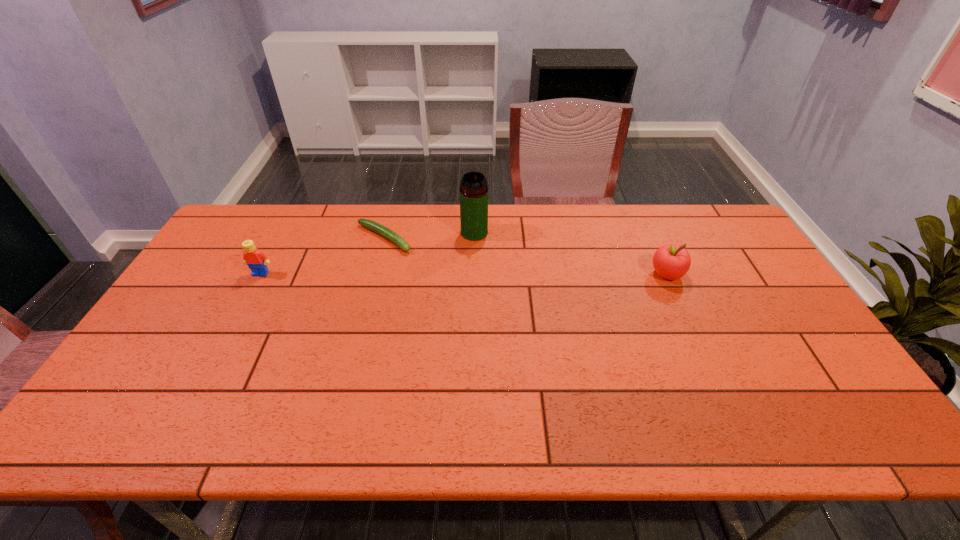
Locate an element on the screen. The width and height of the screenshot is (960, 540). the leftmost object is located at coordinates (256, 260).

Where is `apple`? apple is located at coordinates (671, 262).

The width and height of the screenshot is (960, 540). In order to click on the tallest object in this screenshot , I will do `click(473, 189)`.

Identify the location of the second object from right to left. This screenshot has width=960, height=540. (473, 189).

The width and height of the screenshot is (960, 540). I want to click on zucchini, so click(x=369, y=224).

This screenshot has height=540, width=960. I want to click on the third object from right to left, so click(x=369, y=224).

Find the location of a particular element. vacant space located on the face of the Lego is located at coordinates (216, 357).

Image resolution: width=960 pixels, height=540 pixels. I want to click on vacant area located on the left of the rightmost object, so click(x=526, y=274).

Identify the location of vacant space positioned from the spout of the tallest object. (526, 327).

Locate an element on the screen. free spot located 0.320m from the spout of the tallest object is located at coordinates click(x=515, y=307).